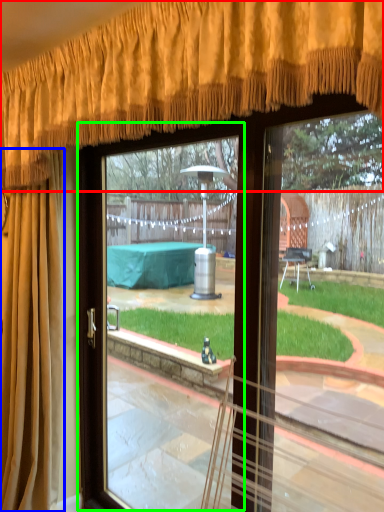
Question: Based on their relative distances, which object is farther from curtain (highlighted by a red box)? Choose from curtain (highlighted by a blue box) and screen door (highlighted by a green box).

Choices:
 (A) curtain
 (B) screen door

Answer: (B)